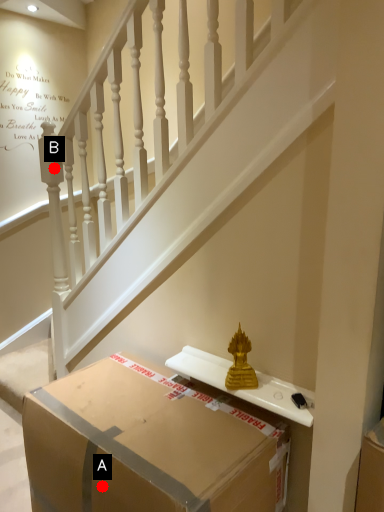
Question: Two points are circled on the image, labeled by A and B beside each circle. Which point is closer to the camera?

Choices:
 (A) A is closer
 (B) B is closer

Answer: (A)